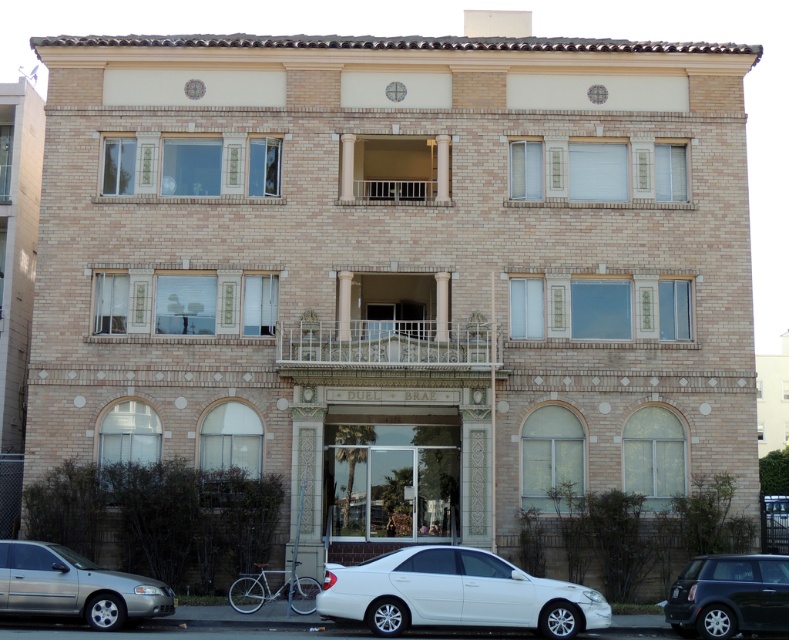
The width and height of the screenshot is (789, 640). What are the coordinates of `white glossy sedan at lower center` in the screenshot? It's located at (455, 593).

Is white glossy sedan at lower center to the right of shiny black car at lower right from the viewer's perspective?

Incorrect, white glossy sedan at lower center is not on the right side of shiny black car at lower right.

Locate an element on the screen. Image resolution: width=789 pixels, height=640 pixels. white glossy sedan at lower center is located at coordinates (455, 593).

Which is above, white glossy sedan at lower center or white wrought iron balcony at center?

white wrought iron balcony at center is higher up.

Who is lower down, white glossy sedan at lower center or white wrought iron balcony at center?

white glossy sedan at lower center is lower down.

Locate an element on the screen. white glossy sedan at lower center is located at coordinates (455, 593).

At what (x,y) coordinates should I click in order to perform the action: click on white glossy sedan at lower center. Please return your answer as a coordinate pair (x, y). Looking at the image, I should click on (455, 593).

Is shiny black car at lower right thinner than metallic silver balcony at center?

Indeed, shiny black car at lower right has a lesser width compared to metallic silver balcony at center.

Can you confirm if shiny black car at lower right is positioned to the right of metallic silver balcony at center?

Indeed, shiny black car at lower right is positioned on the right side of metallic silver balcony at center.

Does point (687, 588) come closer to viewer compared to point (447, 202)?

Yes, point (687, 588) is in front of point (447, 202).

Identify the location of shiny black car at lower right. (728, 595).